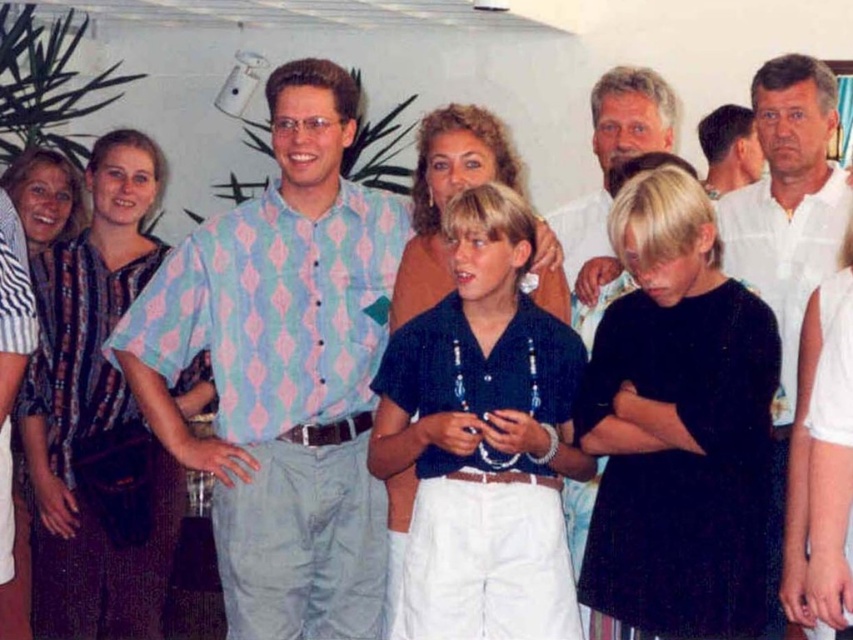
Who is positioned more to the left, black matte dress at center or light brown wood face at center?

From the viewer's perspective, light brown wood face at center appears more on the left side.

Is black matte dress at center to the right of light brown wood face at center from the viewer's perspective?

Yes, black matte dress at center is to the right of light brown wood face at center.

You are a GUI agent. You are given a task and a screenshot of the screen. Output one action in this format:
    pyautogui.click(x=<x>, y=<y>)
    Task: Click on the black matte dress at center
    
    Given the screenshot: What is the action you would take?
    pyautogui.click(x=677, y=426)

Does black matte dress at center appear over matte brown blouse at center?

No.

Who is more distant from viewer, (x=621, y=301) or (x=437, y=157)?

Point (x=437, y=157)

Image resolution: width=853 pixels, height=640 pixels. What are the coordinates of `black matte dress at center` in the screenshot? It's located at (677, 426).

Which is above, striped fabric blouse at left or striped fabric dress at left?

striped fabric dress at left

Which is more to the right, striped fabric blouse at left or striped fabric dress at left?

striped fabric blouse at left is more to the right.

Which is in front, point (123, 262) or point (9, 188)?

Point (123, 262) is in front.

Find the location of a particular element. This screenshot has width=853, height=640. striped fabric blouse at left is located at coordinates (97, 419).